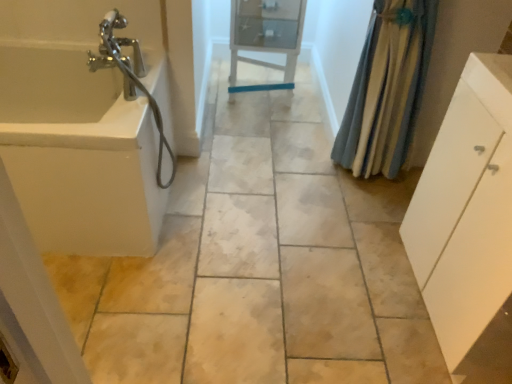
Question: Is white glossy cabinet at center to the left of white glossy bathtub at left from the viewer's perspective?

Choices:
 (A) yes
 (B) no

Answer: (B)

Question: Can you confirm if white glossy cabinet at center is positioned to the right of white glossy bathtub at left?

Choices:
 (A) yes
 (B) no

Answer: (A)

Question: Is white glossy cabinet at center positioned with its back to white glossy bathtub at left?

Choices:
 (A) yes
 (B) no

Answer: (B)

Question: From a real-world perspective, is white glossy cabinet at center physically above white glossy bathtub at left?

Choices:
 (A) no
 (B) yes

Answer: (B)

Question: Does white glossy cabinet at center come behind white glossy bathtub at left?

Choices:
 (A) yes
 (B) no

Answer: (A)

Question: Can you confirm if white glossy cabinet at center is taller than white glossy bathtub at left?

Choices:
 (A) yes
 (B) no

Answer: (A)

Question: Is white glossy cabinet at center far away from white matte cabinet at right?

Choices:
 (A) yes
 (B) no

Answer: (A)

Question: Is white glossy cabinet at center at the left side of white matte cabinet at right?

Choices:
 (A) yes
 (B) no

Answer: (A)

Question: Is white matte cabinet at right inside white glossy cabinet at center?

Choices:
 (A) no
 (B) yes

Answer: (A)

Question: Considering the relative sizes of white glossy cabinet at center and white matte cabinet at right in the image provided, is white glossy cabinet at center thinner than white matte cabinet at right?

Choices:
 (A) yes
 (B) no

Answer: (A)

Question: Does white glossy cabinet at center have a greater height compared to white matte cabinet at right?

Choices:
 (A) yes
 (B) no

Answer: (B)

Question: From the image's perspective, would you say white glossy cabinet at center is shown under white matte cabinet at right?

Choices:
 (A) no
 (B) yes

Answer: (A)

Question: Is white glossy cabinet at center not close to blue textured fabric shower curtain at right?

Choices:
 (A) no
 (B) yes

Answer: (A)